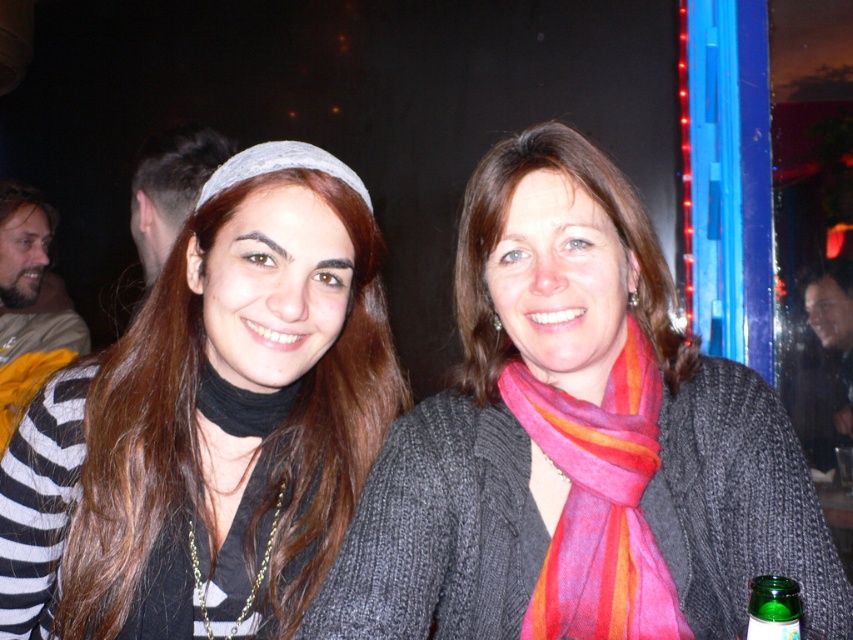
You are a photographer trying to adjust the lighting for a photo shoot. You notice the matte black headband at upper left and the striped wool scarf at center. Which accessory is located more to the left in the image?

The matte black headband at upper left is positioned more to the left than the striped wool scarf at center.

You are standing in a dimly lit room at a social event. You see a matte black headband at upper left. Can you estimate its coordinates in the room?

The coordinates of the matte black headband at upper left are at point (212,422).